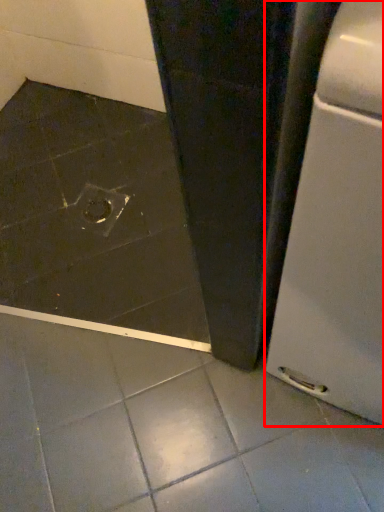
Question: Where is home appliance (annotated by the red box) located in relation to drain in the image?

Choices:
 (A) right
 (B) left

Answer: (A)